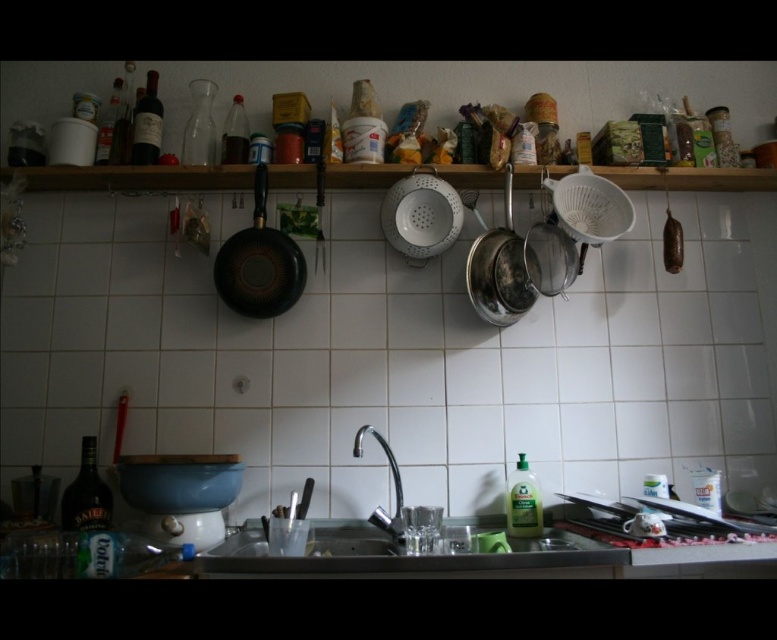
Question: Which point is closer to the camera?

Choices:
 (A) (523, 557)
 (B) (258, 218)

Answer: (A)

Question: Can you confirm if stainless steel sink at lower center is positioned to the left of black matte frying pan at upper left?

Choices:
 (A) yes
 (B) no

Answer: (B)

Question: Which point appears farthest from the camera in this image?

Choices:
 (A) (267, 243)
 (B) (370, 522)

Answer: (A)

Question: Can you confirm if stainless steel sink at lower center is positioned to the left of black matte frying pan at upper left?

Choices:
 (A) no
 (B) yes

Answer: (A)

Question: Which of the following is the closest to the observer?

Choices:
 (A) black matte frying pan at upper left
 (B) stainless steel sink at lower center

Answer: (B)

Question: Can you confirm if stainless steel sink at lower center is wider than black matte frying pan at upper left?

Choices:
 (A) yes
 (B) no

Answer: (A)